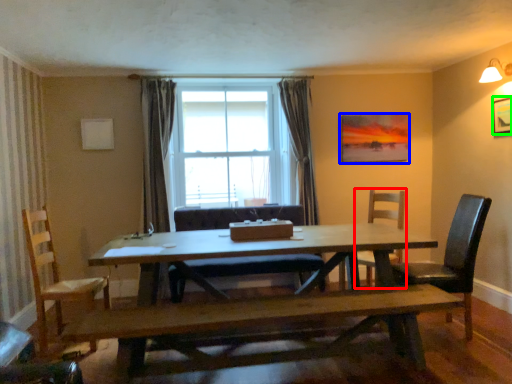
Question: Considering the real-world distances, which object is closest to chair (highlighted by a red box)? picture frame (highlighted by a blue box) or picture frame (highlighted by a green box).

Choices:
 (A) picture frame
 (B) picture frame

Answer: (A)